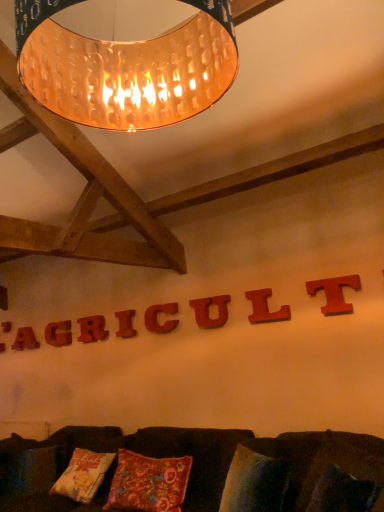
Question: Considering the relative positions of matte red wooden t at upper center, the eighth letter in the back-to-front sequence, and velvet cushion at lower center in the image provided, is matte red wooden t at upper center, the eighth letter in the back-to-front sequence, to the left of velvet cushion at lower center from the viewer's perspective?

Choices:
 (A) no
 (B) yes

Answer: (A)

Question: From a real-world perspective, is matte red wooden t at upper center, the eighth letter in the back-to-front sequence, located beneath velvet cushion at lower center?

Choices:
 (A) yes
 (B) no

Answer: (B)

Question: Can you confirm if matte red wooden t at upper center, which appears as the 1th letter when viewed from the front, is bigger than velvet cushion at lower center?

Choices:
 (A) yes
 (B) no

Answer: (B)

Question: Can you confirm if matte red wooden t at upper center, the 8th letter viewed from the left, is thinner than velvet cushion at lower center?

Choices:
 (A) no
 (B) yes

Answer: (B)

Question: From a real-world perspective, is matte red wooden t at upper center, the eighth letter in the back-to-front sequence, over velvet cushion at lower center?

Choices:
 (A) yes
 (B) no

Answer: (A)

Question: Considering the positions of floral-patterned fabric pillow at center and wooden letter at center, acting as the 6th letter starting from the front, in the image, is floral-patterned fabric pillow at center wider or thinner than wooden letter at center, acting as the 6th letter starting from the front,?

Choices:
 (A) wide
 (B) thin

Answer: (A)

Question: Considering the positions of floral-patterned fabric pillow at center and wooden letter at center, which is the 3th letter in back-to-front order, in the image, is floral-patterned fabric pillow at center taller or shorter than wooden letter at center, which is the 3th letter in back-to-front order,?

Choices:
 (A) short
 (B) tall

Answer: (B)

Question: From the image's perspective, is floral-patterned fabric pillow at center positioned above or below wooden letter at center, marked as the 6th letter in a right-to-left arrangement?

Choices:
 (A) above
 (B) below

Answer: (B)

Question: Looking at the image, does floral-patterned fabric pillow at center seem bigger or smaller compared to wooden letter at center, marked as the 6th letter in a right-to-left arrangement?

Choices:
 (A) small
 (B) big

Answer: (B)

Question: Considering the relative positions of velvet cushion at lower center and wooden letter at center, which is the seventh letter in back-to-front order, in the image provided, is velvet cushion at lower center to the left or to the right of wooden letter at center, which is the seventh letter in back-to-front order,?

Choices:
 (A) left
 (B) right

Answer: (A)

Question: Is point (119, 436) closer or farther from the camera than point (286, 318)?

Choices:
 (A) closer
 (B) farther

Answer: (B)

Question: Considering their positions, is velvet cushion at lower center located in front of or behind wooden letter at center, the 2th letter when ordered from front to back?

Choices:
 (A) front
 (B) behind

Answer: (A)

Question: Is velvet cushion at lower center spatially inside wooden letter at center, the 2th letter when ordered from front to back, or outside of it?

Choices:
 (A) inside
 (B) outside

Answer: (B)

Question: From a real-world perspective, is wooden letter at center, positioned as the second letter in right-to-left order, positioned above or below matte wooden letter at upper center, which is the seventh letter in front-to-back order?

Choices:
 (A) above
 (B) below

Answer: (A)

Question: Relative to matte wooden letter at upper center, which appears as the seventh letter when viewed from the right, is wooden letter at center, positioned as the second letter in right-to-left order, in front or behind?

Choices:
 (A) behind
 (B) front

Answer: (B)